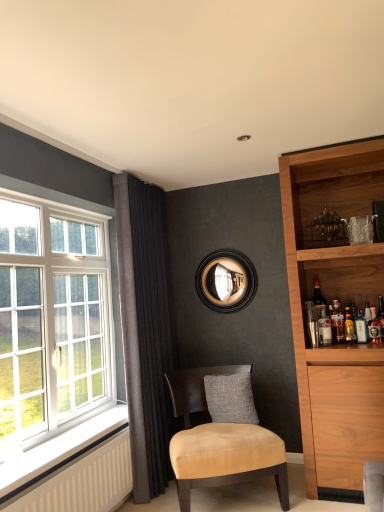
Identify the location of vacant space underneath white glass window at left (from a real-world perspective). The image size is (384, 512). (85, 425).